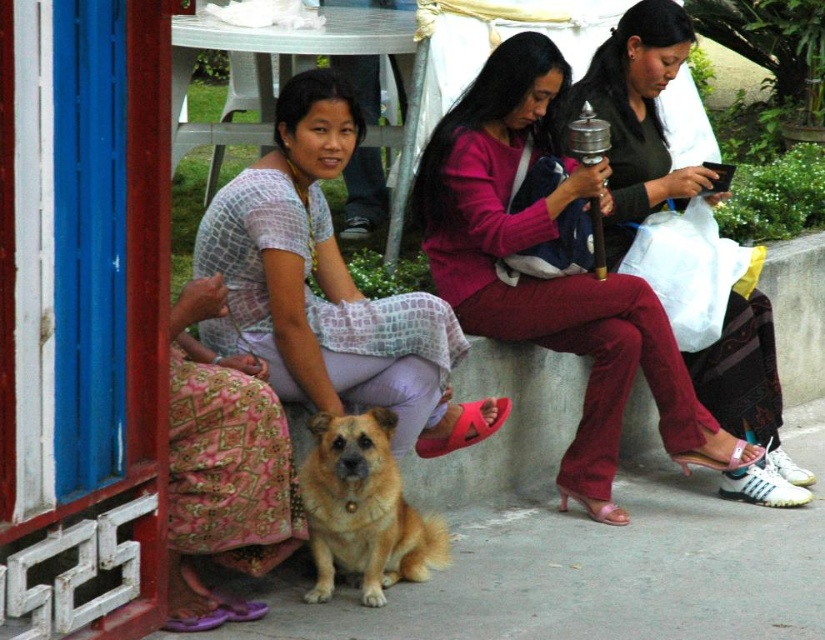
You are a photographer trying to capture a closeup of the matte pink sweater at center and the golden fur dog at center. Which object should you focus on first if you want to take a photo where both are in focus without moving the camera?

The matte pink sweater at center is to the right of the golden fur dog at center. Since they are both at the same distance from the camera, you can focus on either one and both will be in focus.

You are standing at the camera position and want to reach both the point at coordinates point (446, 284) and the point at coordinates point (298, 332). Which point will you reach first as you move forward?

You will reach point (446, 284) first because it is closer to the camera than point (298, 332).

You are a photographer trying to capture a group photo of the matte white dress at center and the golden fur dog at center. Which one should you focus on first if you want to ensure both are in focus?

The matte white dress at center is bigger than the golden fur dog at center, so focusing on the matte white dress at center first will help ensure both are in focus.